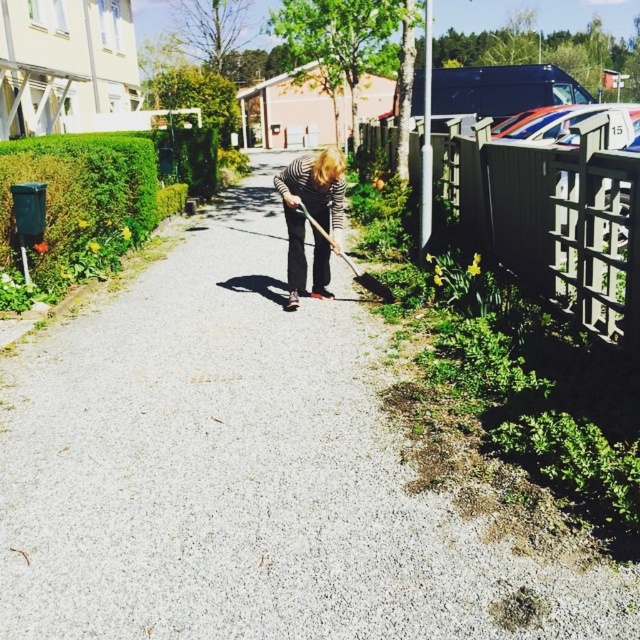
You are standing on the gravel path and want to walk to the pinkish building with a red roof. Which object, the green leafy hedge at left or the striped fabric person at center, will you pass closer to while walking towards the building?

The striped fabric person at center is closer to the path, so you will pass closer to the striped fabric person at center than the green leafy hedge at left.